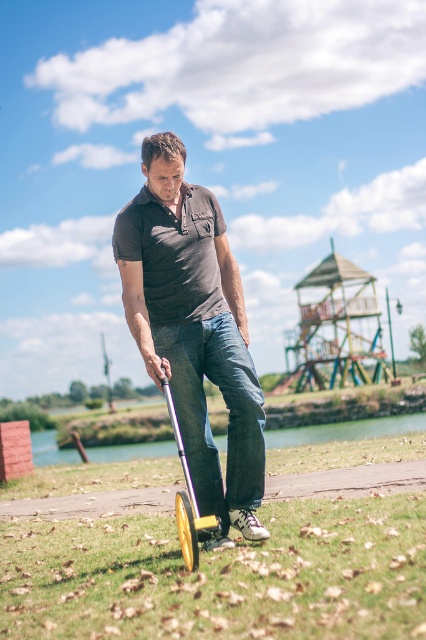
You are a delivery person who needs to place a package on the green grass at lower center and the yellow rubber scooter at lower center. Which surface will the package stay more stable on?

The package will stay more stable on the yellow rubber scooter at lower center because it has a lower height compared to the green grass at lower center, which is taller and might be uneven.

You are standing at the center of the image and want to walk towards the green grass at lower center. According to the coordinates provided, in which direction should you move?

The green grass at lower center is located at point 0.900 on the x axis and 0.519 on the y axis. Since you are at the center, which is point 0.5 on both axes, you should move towards the right and slightly upwards to reach the green grass at lower center.